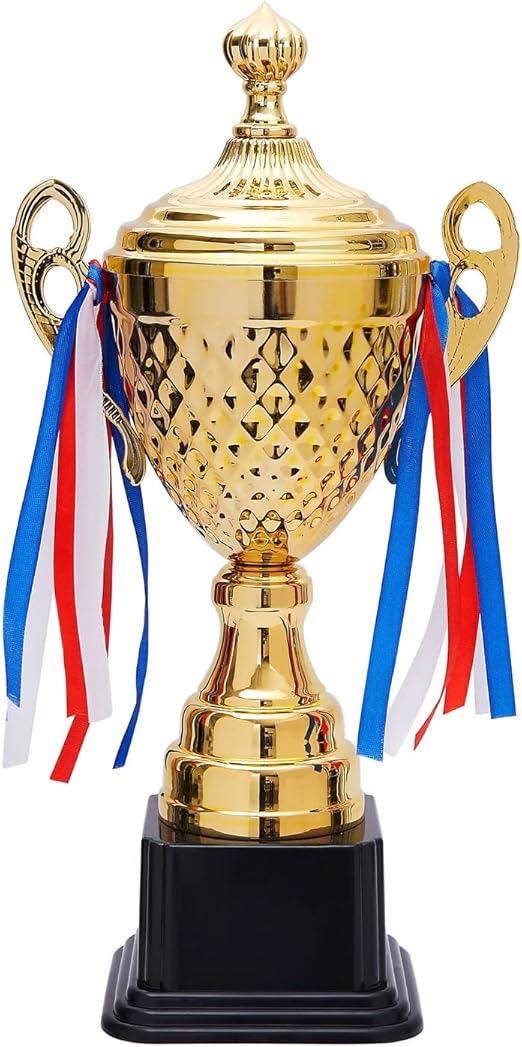
Where is `gold trophy handles`? The image size is (522, 1047). gold trophy handles is located at coordinates point(505,280), point(56,255).